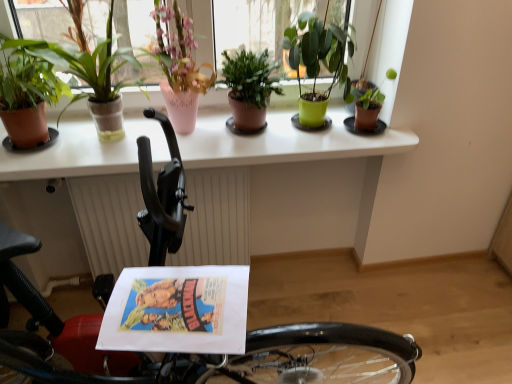
Question: Is terracotta pot plant at left, the 5th houseplant when ordered from right to left, smaller than green matte plant at center, arranged as the 3th houseplant when viewed from the right?

Choices:
 (A) no
 (B) yes

Answer: (A)

Question: Can green matte plant at center, the 4th houseplant positioned from the left, be found inside terracotta pot plant at left, the 5th houseplant when ordered from right to left?

Choices:
 (A) yes
 (B) no

Answer: (B)

Question: From the image's perspective, would you say terracotta pot plant at left, which appears as the 2th houseplant when viewed from the left, is positioned over green matte plant at center, arranged as the 3th houseplant when viewed from the right?

Choices:
 (A) no
 (B) yes

Answer: (B)

Question: Is terracotta pot plant at left, the 5th houseplant when ordered from right to left, turned away from green matte plant at center, the 4th houseplant positioned from the left?

Choices:
 (A) no
 (B) yes

Answer: (A)

Question: Can you confirm if terracotta pot plant at left, which appears as the 2th houseplant when viewed from the left, is taller than green matte plant at center, the 4th houseplant positioned from the left?

Choices:
 (A) no
 (B) yes

Answer: (B)

Question: Would you say green matte plant at upper center, acting as the 5th houseplant starting from the left, is to the left or to the right of white textured radiator at center in the picture?

Choices:
 (A) right
 (B) left

Answer: (A)

Question: From the image's perspective, relative to white textured radiator at center, is green matte plant at upper center, acting as the 5th houseplant starting from the left, above or below?

Choices:
 (A) above
 (B) below

Answer: (A)

Question: Is green matte plant at upper center, acting as the 5th houseplant starting from the left, situated inside white textured radiator at center or outside?

Choices:
 (A) outside
 (B) inside

Answer: (A)

Question: In terms of size, does green matte plant at upper center, acting as the 5th houseplant starting from the left, appear bigger or smaller than white textured radiator at center?

Choices:
 (A) small
 (B) big

Answer: (A)

Question: Considering the relative positions of white glossy counter top at upper center and terracotta pot plant at left, the 5th houseplant when ordered from right to left, in the image provided, is white glossy counter top at upper center to the left or to the right of terracotta pot plant at left, the 5th houseplant when ordered from right to left,?

Choices:
 (A) left
 (B) right

Answer: (B)

Question: Looking at their shapes, would you say white glossy counter top at upper center is wider or thinner than terracotta pot plant at left, which appears as the 2th houseplant when viewed from the left?

Choices:
 (A) thin
 (B) wide

Answer: (B)

Question: Considering their positions, is white glossy counter top at upper center located in front of or behind terracotta pot plant at left, which appears as the 2th houseplant when viewed from the left?

Choices:
 (A) behind
 (B) front

Answer: (A)

Question: Considering the positions of point (3, 135) and point (111, 9), is point (3, 135) closer or farther from the camera than point (111, 9)?

Choices:
 (A) closer
 (B) farther

Answer: (B)

Question: From a real-world perspective, is pink ceramic vase at upper left, which appears as the 4th houseplant when viewed from the right, above or below black rubber bicycle at lower left?

Choices:
 (A) below
 (B) above

Answer: (B)

Question: In terms of height, does pink ceramic vase at upper left, which appears as the 4th houseplant when viewed from the right, look taller or shorter compared to black rubber bicycle at lower left?

Choices:
 (A) tall
 (B) short

Answer: (B)